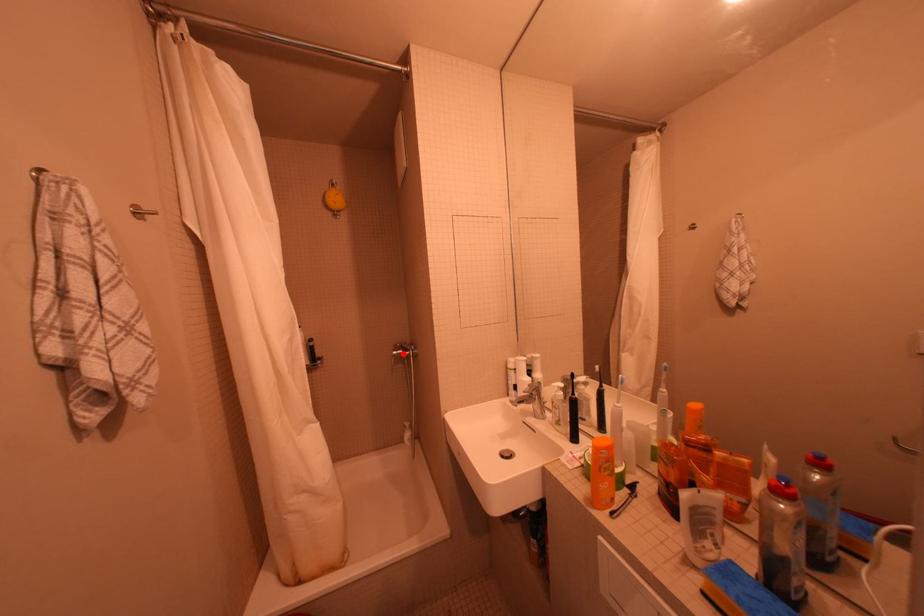
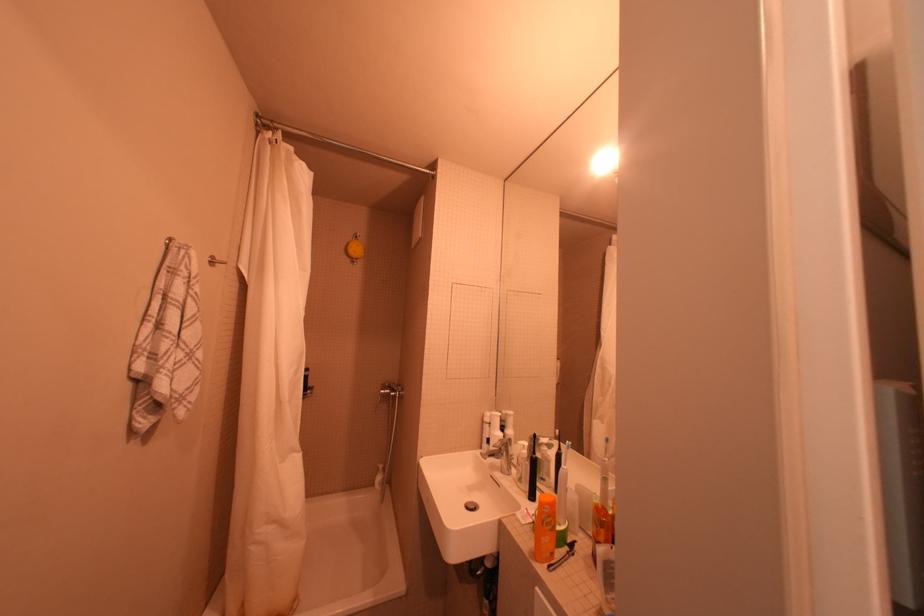
Locate, in the second image, the point that corresponds to the highlighted location in the first image.

(391, 392)